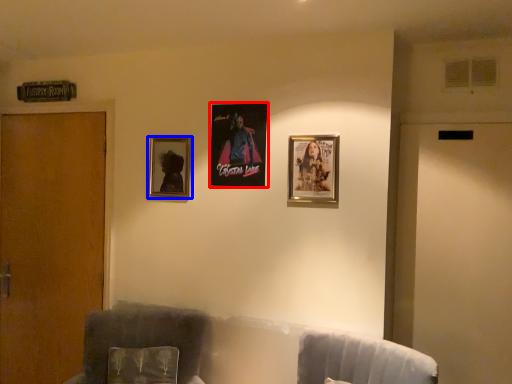
Question: Among these objects, which one is farthest to the camera, picture frame (highlighted by a red box) or picture frame (highlighted by a blue box)?

Choices:
 (A) picture frame
 (B) picture frame

Answer: (B)